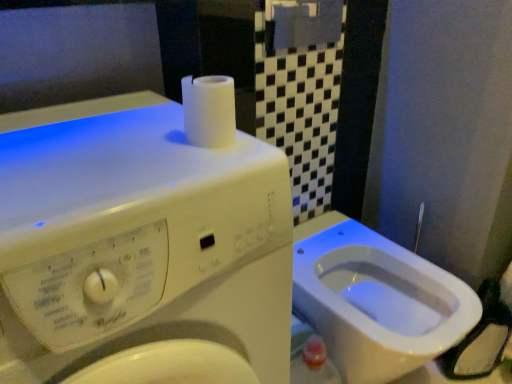
Describe the element at coordinates (376, 300) in the screenshot. I see `white glossy bidet at lower right` at that location.

Describe the element at coordinates (209, 110) in the screenshot. I see `white matte toilet paper at upper center` at that location.

Image resolution: width=512 pixels, height=384 pixels. In order to click on white plastic washing machine at upper left in this screenshot , I will do click(x=140, y=249).

At what (x,y) coordinates should I click in order to perform the action: click on white glossy bidet at lower right. Please return your answer as a coordinate pair (x, y). This screenshot has height=384, width=512. Looking at the image, I should click on (376, 300).

Is white plastic washing machine at upper left thinner than white matte toilet paper at upper center?

In fact, white plastic washing machine at upper left might be wider than white matte toilet paper at upper center.

From a real-world perspective, is white plastic washing machine at upper left located beneath white matte toilet paper at upper center?

Yes, from a real-world perspective, white plastic washing machine at upper left is under white matte toilet paper at upper center.

At what (x,y) coordinates should I click in order to perform the action: click on toilet paper to the right of white plastic washing machine at upper left. Please return your answer as a coordinate pair (x, y). The image size is (512, 384). Looking at the image, I should click on point(209,110).

Which is in front, white plastic washing machine at upper left or white matte toilet paper at upper center?

white plastic washing machine at upper left is more forward.

Which is more to the right, white matte toilet paper at upper center or white plastic washing machine at upper left?

From the viewer's perspective, white matte toilet paper at upper center appears more on the right side.

Looking at this image, from the image's perspective, is white matte toilet paper at upper center located above or below white plastic washing machine at upper left?

Based on their image positions, white matte toilet paper at upper center is located above white plastic washing machine at upper left.

Which object is more forward, white matte toilet paper at upper center or white plastic washing machine at upper left?

white plastic washing machine at upper left.

Can you tell me how much white plastic washing machine at upper left and white glossy bidet at lower right differ in facing direction?

0.0875 degrees separate the facing orientations of white plastic washing machine at upper left and white glossy bidet at lower right.

Considering the relative sizes of white plastic washing machine at upper left and white glossy bidet at lower right in the image provided, is white plastic washing machine at upper left taller than white glossy bidet at lower right?

Indeed, white plastic washing machine at upper left has a greater height compared to white glossy bidet at lower right.

You are a GUI agent. You are given a task and a screenshot of the screen. Output one action in this format:
    pyautogui.click(x=<x>, y=<y>)
    Task: Click on the bidet that appears below the white plastic washing machine at upper left (from a real-world perspective)
    
    Given the screenshot: What is the action you would take?
    pyautogui.click(x=376, y=300)

Considering the relative positions of white plastic washing machine at upper left and white glossy bidet at lower right in the image provided, is white plastic washing machine at upper left to the left of white glossy bidet at lower right from the viewer's perspective?

Yes.

Considering the relative positions of white matte toilet paper at upper center and white glossy bidet at lower right in the image provided, is white matte toilet paper at upper center in front of white glossy bidet at lower right?

Yes, it is in front of white glossy bidet at lower right.

Consider the image. Could you tell me if white matte toilet paper at upper center is facing white glossy bidet at lower right?

No, white matte toilet paper at upper center is not turned towards white glossy bidet at lower right.

Can you confirm if white matte toilet paper at upper center is wider than white glossy bidet at lower right?

No, white matte toilet paper at upper center is not wider than white glossy bidet at lower right.

What's the angular difference between white matte toilet paper at upper center and white glossy bidet at lower right's facing directions?

white matte toilet paper at upper center and white glossy bidet at lower right are facing 0.0594 degrees away from each other.

Is white glossy bidet at lower right next to white matte toilet paper at upper center and touching it?

They are not placed beside each other.

You are a GUI agent. You are given a task and a screenshot of the screen. Output one action in this format:
    pyautogui.click(x=<x>, y=<y>)
    Task: Click on the toilet paper located above the white glossy bidet at lower right (from a real-world perspective)
    
    Given the screenshot: What is the action you would take?
    pyautogui.click(x=209, y=110)

Does point (413, 355) come farther from viewer compared to point (184, 105)?

Yes, it is.

Which is in front, white glossy bidet at lower right or white plastic washing machine at upper left?

white plastic washing machine at upper left.

From the image's perspective, is white glossy bidet at lower right below white plastic washing machine at upper left?

Correct, white glossy bidet at lower right appears lower than white plastic washing machine at upper left in the image.

Is white glossy bidet at lower right not near white plastic washing machine at upper left?

No, there isn't a large distance between white glossy bidet at lower right and white plastic washing machine at upper left.

Between white glossy bidet at lower right and white plastic washing machine at upper left, which one has less height?

white glossy bidet at lower right is shorter.

This screenshot has height=384, width=512. In the image, there is a white matte toilet paper at upper center. Find the location of `washing machine below it (from a real-world perspective)`. washing machine below it (from a real-world perspective) is located at coordinates (140, 249).

This screenshot has height=384, width=512. Find the location of `toilet paper above the white plastic washing machine at upper left (from a real-world perspective)`. toilet paper above the white plastic washing machine at upper left (from a real-world perspective) is located at coordinates [209, 110].

Which object lies nearer to the anchor point white matte toilet paper at upper center, white glossy bidet at lower right or white plastic washing machine at upper left?

Based on the image, white plastic washing machine at upper left appears to be nearer to white matte toilet paper at upper center.

Which object lies further to the anchor point white plastic washing machine at upper left, white glossy bidet at lower right or white matte toilet paper at upper center?

white glossy bidet at lower right is positioned further to the anchor white plastic washing machine at upper left.

Estimate the real-world distances between objects in this image. Which object is further from white plastic washing machine at upper left, white matte toilet paper at upper center or white glossy bidet at lower right?

white glossy bidet at lower right.

Looking at the image, which one is located further to white glossy bidet at lower right, white plastic washing machine at upper left or white matte toilet paper at upper center?

The object further to white glossy bidet at lower right is white matte toilet paper at upper center.

Based on their spatial positions, is white plastic washing machine at upper left or white glossy bidet at lower right further from white matte toilet paper at upper center?

Based on the image, white glossy bidet at lower right appears to be further to white matte toilet paper at upper center.

Estimate the real-world distances between objects in this image. Which object is further from white glossy bidet at lower right, white matte toilet paper at upper center or white plastic washing machine at upper left?

Among the two, white matte toilet paper at upper center is located further to white glossy bidet at lower right.

What are the coordinates of `toilet paper between white plastic washing machine at upper left and white glossy bidet at lower right` in the screenshot? It's located at (209, 110).